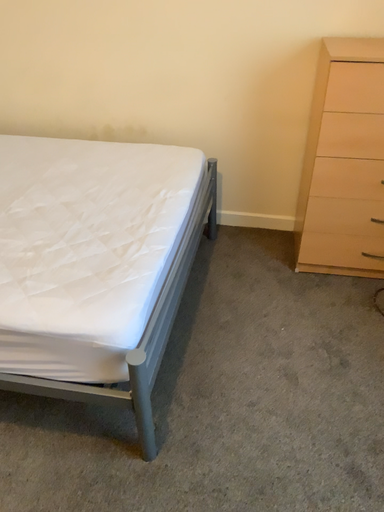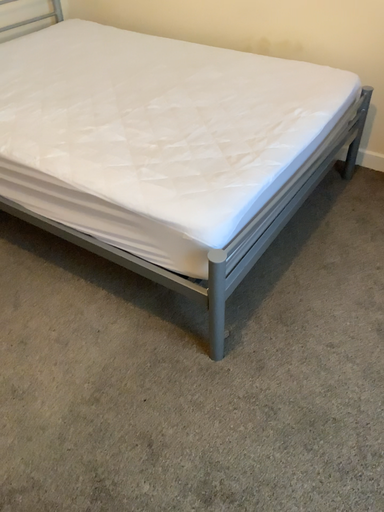
Question: How did the camera likely rotate when shooting the video?

Choices:
 (A) rotated left
 (B) rotated right

Answer: (A)